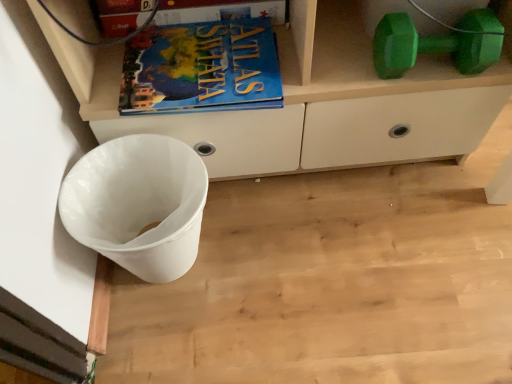
Describe the element at coordinates (138, 204) in the screenshot. I see `white plastic waste bin at lower left` at that location.

Image resolution: width=512 pixels, height=384 pixels. Find the location of `white matte cabinet at lower left`. white matte cabinet at lower left is located at coordinates [309, 101].

Measure the distance between blue matte atlas book at upper center and camera.

The depth of blue matte atlas book at upper center is 32.01 inches.

What do you see at coordinates (218, 11) in the screenshot?
I see `blue matte book at upper center` at bounding box center [218, 11].

What do you see at coordinates (437, 43) in the screenshot?
I see `green rubber dumbbell at upper right` at bounding box center [437, 43].

Locate an element on the screen. white plastic waste bin at lower left is located at coordinates (138, 204).

Is point (159, 23) positioned in front of point (110, 155)?

No, (159, 23) is behind (110, 155).

Based on the photo, from a real-world perspective, relative to white plastic waste bin at lower left, is blue matte book at upper center vertically above or below?

blue matte book at upper center is situated higher than white plastic waste bin at lower left in the real world.

How distant is blue matte book at upper center from white plastic waste bin at lower left?

15.20 inches.

Who is smaller, blue matte book at upper center or white plastic waste bin at lower left?

blue matte book at upper center is smaller.

Is white plastic waste bin at lower left positioned with its back to white matte cabinet at lower left?

No.

From the picture: Is white plastic waste bin at lower left inside the boundaries of white matte cabinet at lower left, or outside?

white plastic waste bin at lower left is spatially situated outside white matte cabinet at lower left.

Is white plastic waste bin at lower left closer to the viewer compared to white matte cabinet at lower left?

That is False.

Considering the sizes of white plastic waste bin at lower left and blue matte atlas book at upper center in the image, is white plastic waste bin at lower left taller or shorter than blue matte atlas book at upper center?

In the image, white plastic waste bin at lower left appears to be taller than blue matte atlas book at upper center.

Is point (93, 170) farther from viewer compared to point (126, 51)?

No, it is in front of (126, 51).

Locate an element on the screen. The width and height of the screenshot is (512, 384). book lying behind the white plastic waste bin at lower left is located at coordinates (201, 68).

Is white plastic waste bin at lower left facing away from blue matte atlas book at upper center?

white plastic waste bin at lower left does not have its back to blue matte atlas book at upper center.

How many degrees apart are the facing directions of blue matte book at upper center and white matte cabinet at lower left?

The angle between the facing direction of blue matte book at upper center and the facing direction of white matte cabinet at lower left is 0.263 degrees.

From a real-world perspective, is blue matte book at upper center physically below white matte cabinet at lower left?

No.

Who is shorter, blue matte book at upper center or white matte cabinet at lower left?

blue matte book at upper center.

Is blue matte book at upper center turned away from white matte cabinet at lower left?

Absolutely, blue matte book at upper center is directed away from white matte cabinet at lower left.

Who is bigger, blue matte book at upper center or blue matte atlas book at upper center?

Bigger between the two is blue matte atlas book at upper center.

Is blue matte book at upper center aimed at blue matte atlas book at upper center?

Yes, blue matte book at upper center is aimed at blue matte atlas book at upper center.

Can we say blue matte book at upper center lies outside blue matte atlas book at upper center?

That's correct, blue matte book at upper center is outside of blue matte atlas book at upper center.

From a real-world perspective, is blue matte book at upper center beneath blue matte atlas book at upper center?

No.

Does point (259, 108) lie in front of point (240, 14)?

Yes, it is in front of point (240, 14).

Is blue matte atlas book at upper center to the right of blue matte book at upper center from the viewer's perspective?

Yes, blue matte atlas book at upper center is to the right of blue matte book at upper center.

From the image's perspective, which one is positioned lower, blue matte atlas book at upper center or blue matte book at upper center?

blue matte atlas book at upper center is shown below in the image.

Is blue matte atlas book at upper center in front of or behind blue matte book at upper center in the image?

blue matte atlas book at upper center is in front of blue matte book at upper center.

Is green rubber dumbbell at upper right not inside blue matte book at upper center?

Yes, green rubber dumbbell at upper right is located beyond the bounds of blue matte book at upper center.

Which of these two, green rubber dumbbell at upper right or blue matte book at upper center, stands taller?

Standing taller between the two is green rubber dumbbell at upper right.

Is green rubber dumbbell at upper right thinner than blue matte book at upper center?

No, green rubber dumbbell at upper right is not thinner than blue matte book at upper center.

How far apart are green rubber dumbbell at upper right and blue matte book at upper center?

A distance of 14.45 inches exists between green rubber dumbbell at upper right and blue matte book at upper center.

I want to click on waste container in front of the blue matte book at upper center, so click(138, 204).

Image resolution: width=512 pixels, height=384 pixels. What are the coordinates of `cabinetry lying on the right of white plastic waste bin at lower left` in the screenshot? It's located at (309, 101).

Looking at the image, which one is located further to blue matte atlas book at upper center, blue matte book at upper center or white matte cabinet at lower left?

white matte cabinet at lower left lies further to blue matte atlas book at upper center than the other object.

Which object lies further to the anchor point white matte cabinet at lower left, blue matte book at upper center or white plastic waste bin at lower left?

white plastic waste bin at lower left lies further to white matte cabinet at lower left than the other object.

Based on their spatial positions, is blue matte atlas book at upper center or green rubber dumbbell at upper right closer to blue matte book at upper center?

Based on the image, blue matte atlas book at upper center appears to be nearer to blue matte book at upper center.

Consider the image. When comparing their distances from white plastic waste bin at lower left, does blue matte book at upper center or white matte cabinet at lower left seem closer?

Based on the image, white matte cabinet at lower left appears to be nearer to white plastic waste bin at lower left.

Looking at the image, which one is located closer to white matte cabinet at lower left, blue matte atlas book at upper center or white plastic waste bin at lower left?

blue matte atlas book at upper center is closer to white matte cabinet at lower left.

Estimate the real-world distances between objects in this image. Which object is further from blue matte book at upper center, green rubber dumbbell at upper right or blue matte atlas book at upper center?

green rubber dumbbell at upper right lies further to blue matte book at upper center than the other object.

Looking at this image, when comparing their distances from white matte cabinet at lower left, does blue matte atlas book at upper center or green rubber dumbbell at upper right seem closer?

The object closer to white matte cabinet at lower left is blue matte atlas book at upper center.

From the image, which object appears to be farther from white matte cabinet at lower left, blue matte book at upper center or green rubber dumbbell at upper right?

blue matte book at upper center is further to white matte cabinet at lower left.

Where is `book between blue matte book at upper center and green rubber dumbbell at upper right in the horizontal direction`? This screenshot has width=512, height=384. book between blue matte book at upper center and green rubber dumbbell at upper right in the horizontal direction is located at coordinates (201, 68).

Find the location of a particular element. book located between white matte cabinet at lower left and blue matte book at upper center in the depth direction is located at coordinates (201, 68).

This screenshot has width=512, height=384. In order to click on cabinetry located between white plastic waste bin at lower left and green rubber dumbbell at upper right in the left-right direction in this screenshot , I will do `click(309, 101)`.

The height and width of the screenshot is (384, 512). Find the location of `book between blue matte book at upper center and white plastic waste bin at lower left in the vertical direction`. book between blue matte book at upper center and white plastic waste bin at lower left in the vertical direction is located at coordinates [201, 68].